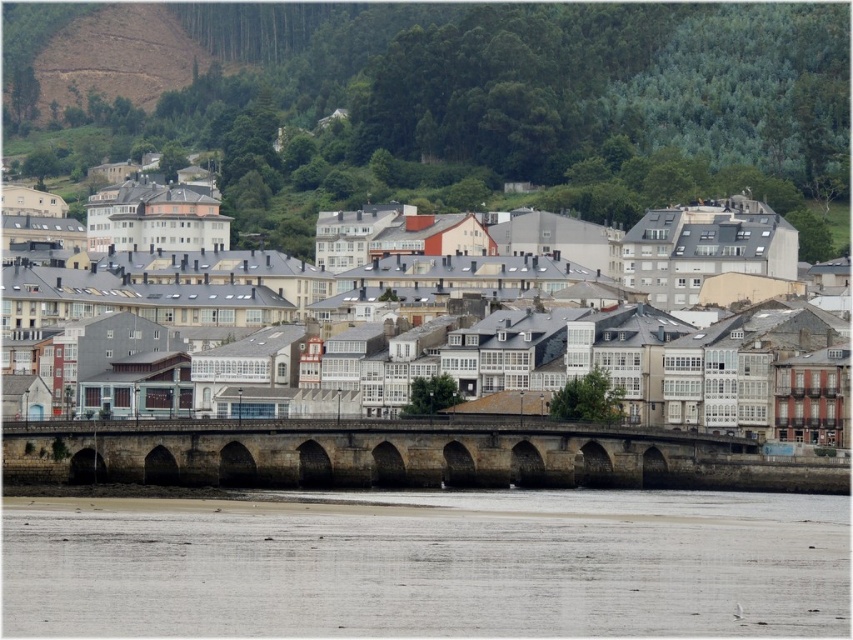
Question: Can you confirm if gray sand at lower center is positioned to the right of stone arch bridge at center?

Choices:
 (A) yes
 (B) no

Answer: (A)

Question: Which point appears farthest from the camera in this image?

Choices:
 (A) (469, 440)
 (B) (848, 589)

Answer: (A)

Question: Is white stone buildings at center above stone arch bridge at center?

Choices:
 (A) no
 (B) yes

Answer: (B)

Question: Which point is farther to the camera?

Choices:
 (A) gray sand at lower center
 (B) stone arch bridge at center

Answer: (B)

Question: Can you confirm if gray sand at lower center is positioned below stone arch bridge at center?

Choices:
 (A) yes
 (B) no

Answer: (A)

Question: Among these objects, which one is farthest from the camera?

Choices:
 (A) white stone buildings at center
 (B) stone arch bridge at center

Answer: (A)